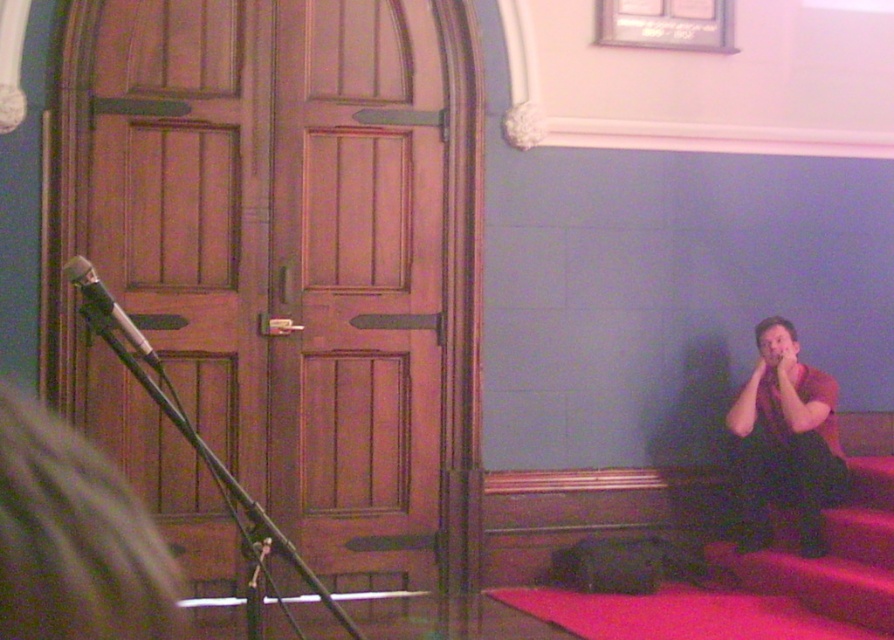
You are standing in the room and want to determine which of the two points, point (x=755, y=536) or point (x=781, y=573), is closer to you. Based on the description, which point is closer?

Point (x=755, y=536) is closer to you because it is further to the camera than point (x=781, y=573).